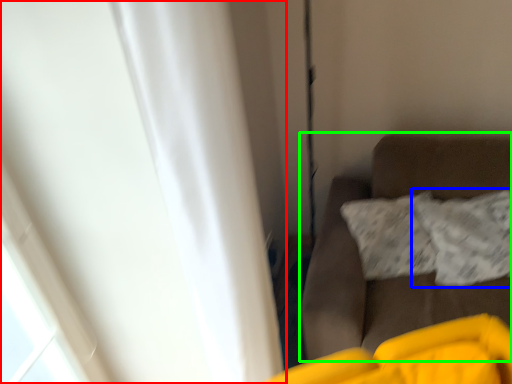
Question: Which is nearer to the curtain (highlighted by a red box)? pillow (highlighted by a blue box) or furniture (highlighted by a green box).

Choices:
 (A) pillow
 (B) furniture

Answer: (B)